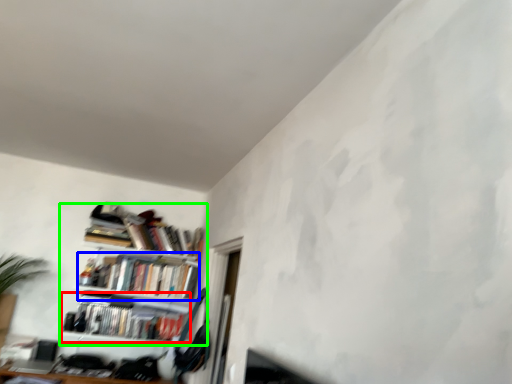
Question: Estimate the real-world distances between objects in this image. Which object is closer to book (highlighted by a red box), book (highlighted by a blue box) or shelf (highlighted by a green box)?

Choices:
 (A) book
 (B) shelf

Answer: (B)